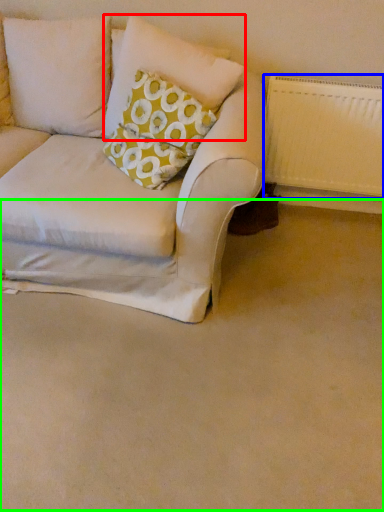
Question: Which object is the closest to the pillow (highlighted by a red box)? Choose among these: radiator (highlighted by a blue box) or plain (highlighted by a green box).

Choices:
 (A) radiator
 (B) plain

Answer: (A)